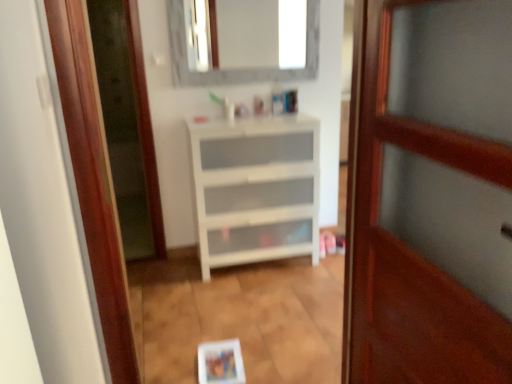
Question: Is wooden door at center taller than white matte chest of drawers at center?

Choices:
 (A) no
 (B) yes

Answer: (B)

Question: Does wooden door at center appear on the left side of white matte chest of drawers at center?

Choices:
 (A) no
 (B) yes

Answer: (A)

Question: Is wooden door at center thinner than white matte chest of drawers at center?

Choices:
 (A) no
 (B) yes

Answer: (B)

Question: Is wooden door at center outside white matte chest of drawers at center?

Choices:
 (A) yes
 (B) no

Answer: (A)

Question: Is wooden door at center surrounding white matte chest of drawers at center?

Choices:
 (A) yes
 (B) no

Answer: (B)

Question: From a real-world perspective, is wooden door at center on top of white matte chest of drawers at center?

Choices:
 (A) no
 (B) yes

Answer: (B)

Question: Can you confirm if white matte chest of drawers at center is wider than wooden door at center?

Choices:
 (A) no
 (B) yes

Answer: (B)

Question: Is wooden door at center inside white matte chest of drawers at center?

Choices:
 (A) no
 (B) yes

Answer: (A)

Question: Considering the relative sizes of white matte chest of drawers at center and wooden door at center in the image provided, is white matte chest of drawers at center smaller than wooden door at center?

Choices:
 (A) yes
 (B) no

Answer: (B)

Question: Is white matte chest of drawers at center closer to the viewer compared to wooden door at center?

Choices:
 (A) no
 (B) yes

Answer: (A)

Question: Could you tell me if white matte chest of drawers at center is turned towards wooden door at center?

Choices:
 (A) yes
 (B) no

Answer: (A)

Question: Are white matte chest of drawers at center and wooden door at center beside each other?

Choices:
 (A) yes
 (B) no

Answer: (B)

Question: From a real-world perspective, is white marble mirror at upper center below wooden door at center?

Choices:
 (A) no
 (B) yes

Answer: (A)